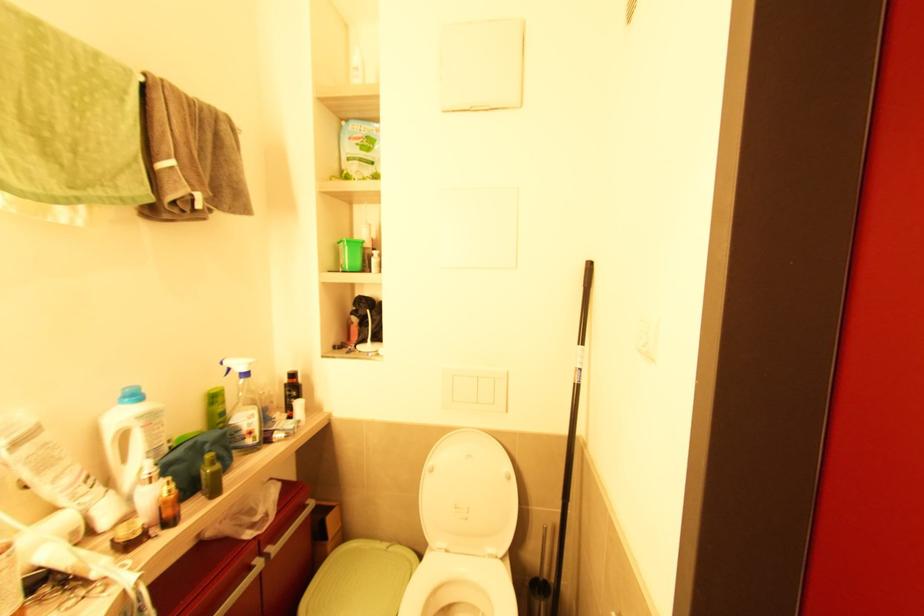
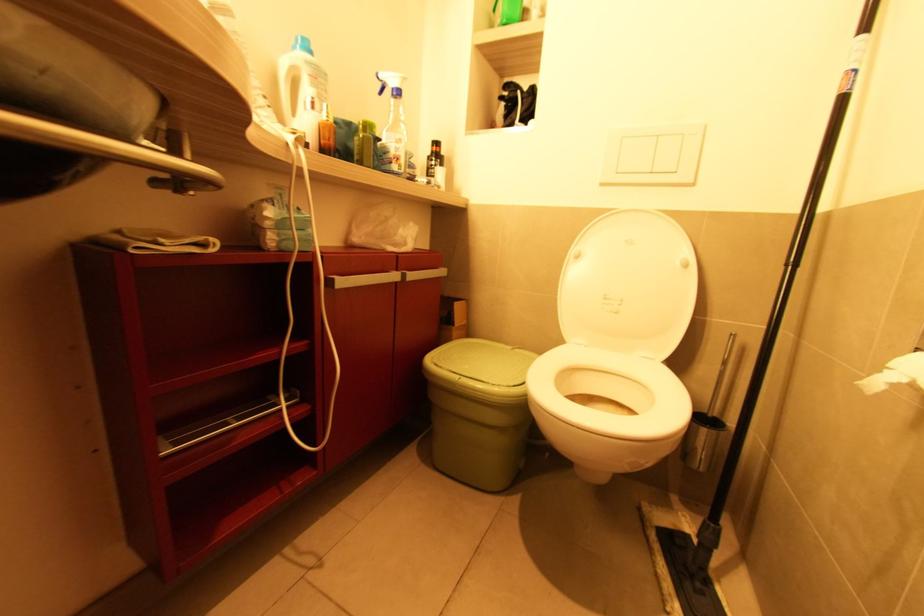
Question: The camera is either moving clockwise (left) or counter-clockwise (right) around the object. The first image is from the beginning of the video and the second image is from the end. Is the camera moving left or right when shooting the video?

Choices:
 (A) Left
 (B) Right

Answer: (B)